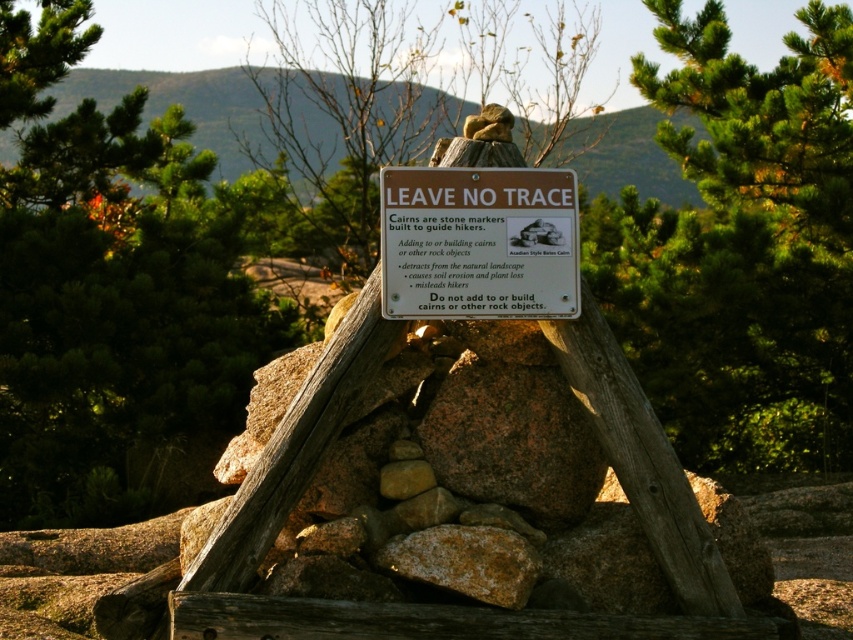
Is point (706, 420) positioned in front of point (512, 307)?

No, it is behind (512, 307).

Based on the photo, who is taller, green leafy tree at upper right or brown paper sign at center?

With more height is green leafy tree at upper right.

Is point (712, 17) closer to viewer compared to point (548, 310)?

No, it is behind (548, 310).

Image resolution: width=853 pixels, height=640 pixels. In order to click on green leafy tree at upper right in this screenshot , I will do `click(741, 248)`.